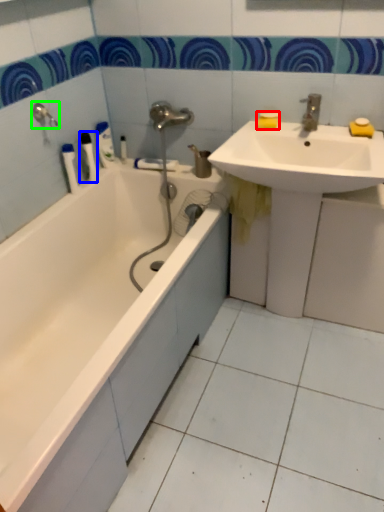
Question: Based on their relative distances, which object is nearer to soap (highlighted by a red box)? Choose from toiletry (highlighted by a blue box) and shower (highlighted by a green box).

Choices:
 (A) toiletry
 (B) shower

Answer: (A)